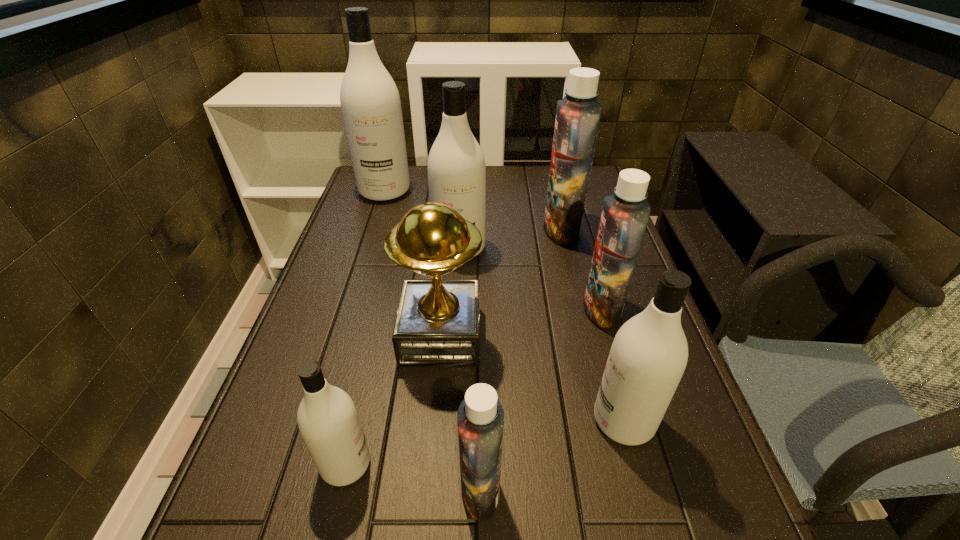
Where is `the farthest object`? the farthest object is located at coordinates (370, 102).

This screenshot has width=960, height=540. In order to click on the tallest object in this screenshot , I will do `click(370, 102)`.

This screenshot has height=540, width=960. Identify the location of the biggest blue shampoo. (578, 114).

At what (x,y) coordinates should I click in order to perform the action: click on the third nearest white shampoo. Please return your answer as a coordinate pair (x, y). This screenshot has height=540, width=960. Looking at the image, I should click on (456, 166).

Locate an element on the screen. This screenshot has height=540, width=960. the second white shampoo from right to left is located at coordinates (456, 166).

Where is `the second nearest blue shampoo`? The height and width of the screenshot is (540, 960). the second nearest blue shampoo is located at coordinates (625, 215).

Locate an element on the screen. The height and width of the screenshot is (540, 960). the second smallest blue shampoo is located at coordinates (625, 215).

Find the location of a particular element. The width and height of the screenshot is (960, 540). the second smallest white shampoo is located at coordinates (648, 356).

Locate an element on the screen. award is located at coordinates (437, 324).

Where is `the leftmost blue shampoo`? This screenshot has height=540, width=960. the leftmost blue shampoo is located at coordinates (480, 419).